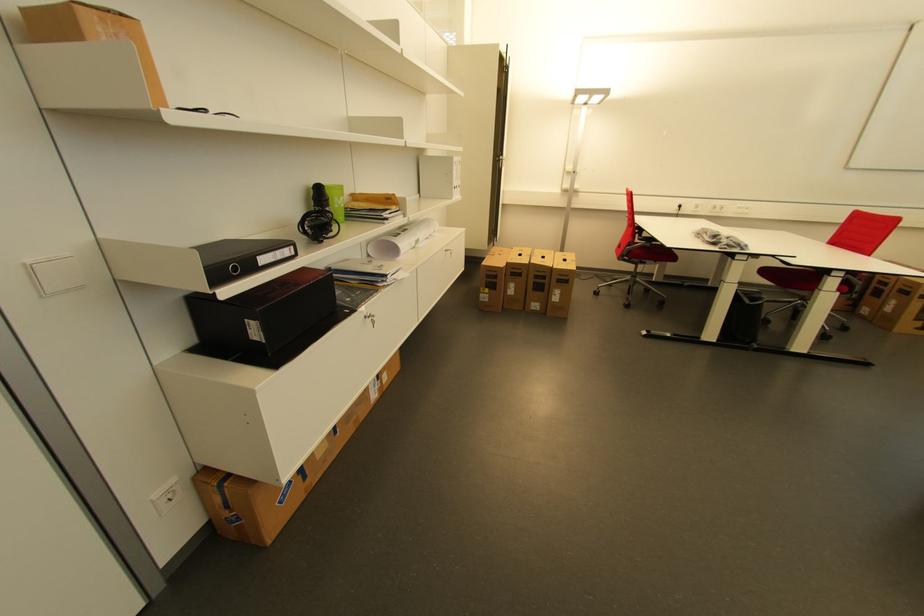
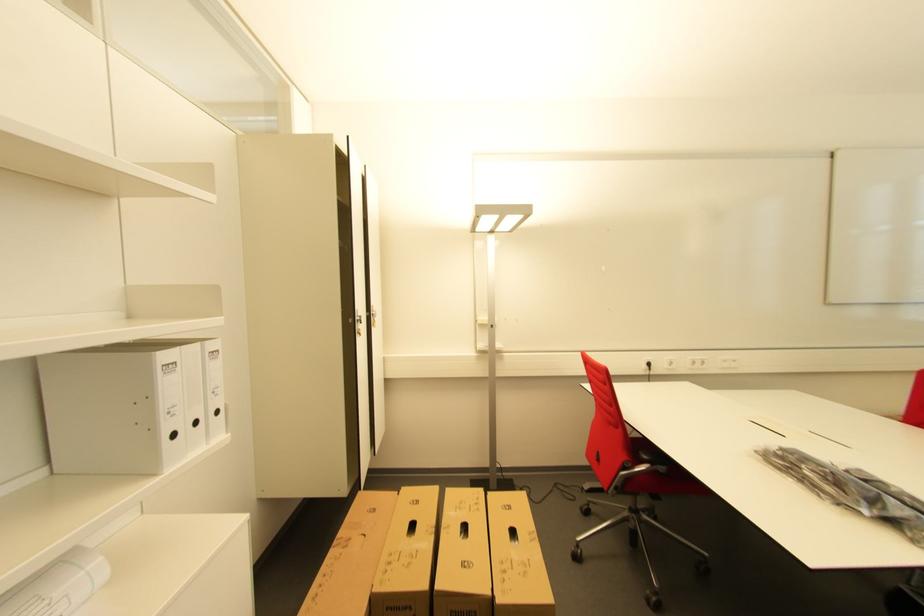
Question: In a continuous first-person perspective shot, in which direction is the camera moving?

Choices:
 (A) Left
 (B) Right
 (C) Forward
 (D) Backward

Answer: (C)